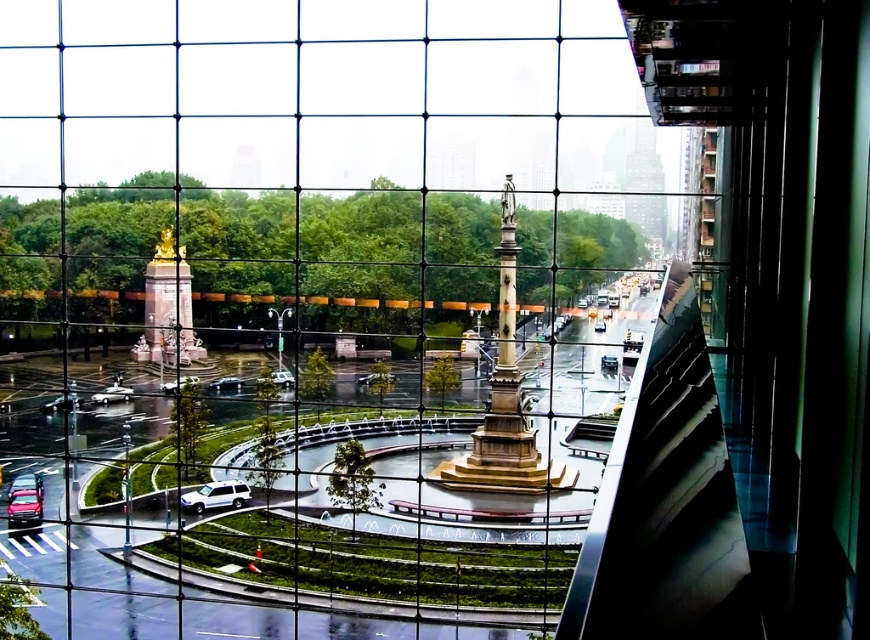
You are standing at the point marked as point (37, 481) in the square. You want to take a photo of the monument on the left with the golden figure using a camera. Considering the distance between you and the camera, will the monument be in focus if the camera has a maximum focusing distance of 70 meters?

The distance between you at point (37, 481) and the camera is 75.22 meters, which exceeds the camera maximum focusing distance of 70 meters. Therefore, the monument will not be in focus.

You are a delivery person trying to park your shiny silver car at lower left in the parking spot where the shiny silver car at center is currently parked. Based on the space available, do you think your car will fit?

The shiny silver car at lower left might be wider than shiny silver car at center, so there is a possibility that it may not fit in the parking spot.